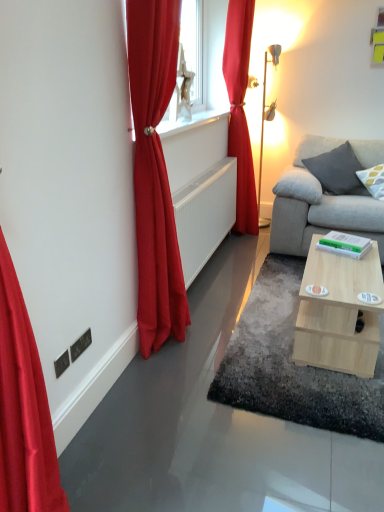
Find the location of a particular element. vacant area situated below satin red curtain at left, positioned as the 1th curtain in front-to-back order (from a real-world perspective) is located at coordinates (180, 338).